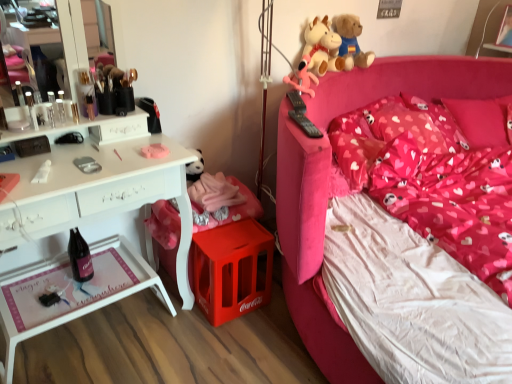
The image size is (512, 384). What are the coordinates of `free space in front of black glass bottle at lower left` in the screenshot? It's located at (79, 300).